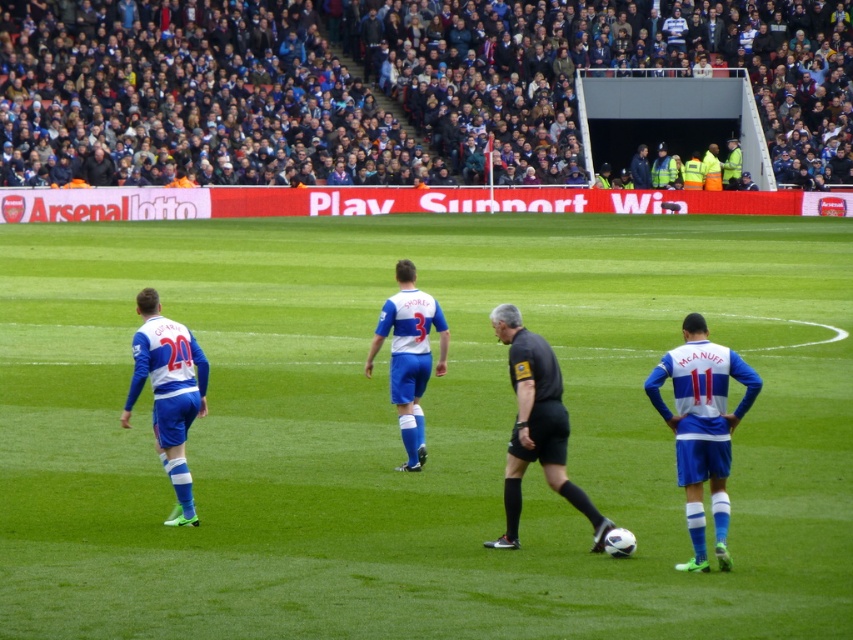
You are a soccer coach analyzing the match. You notice the black matte referee at center and the white matte jersey at center. Which object has a larger width?

The black matte referee at center might be wider than the white matte jersey at center.